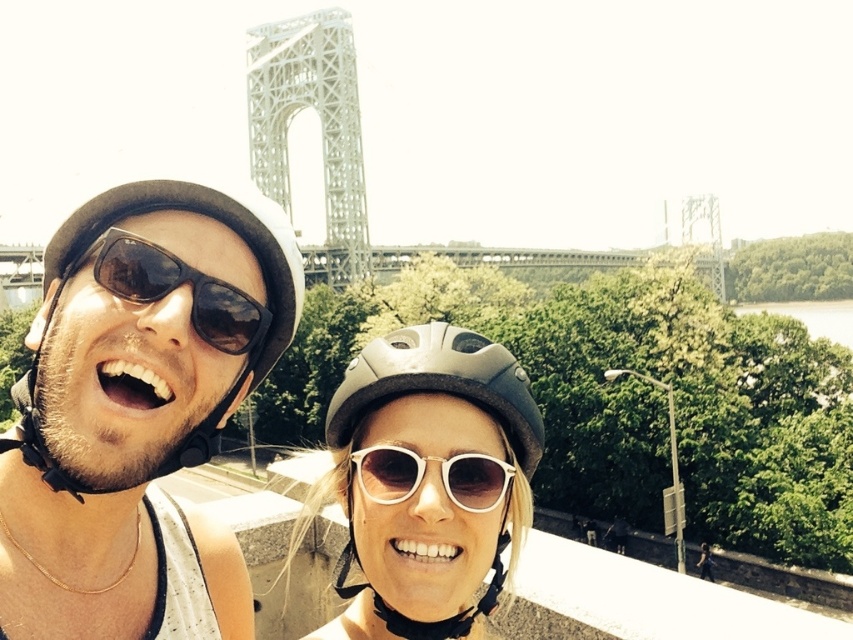
At what (x,y) coordinates should I click in order to perform the action: click on matte black helmet at left. Please return your answer as a coordinate pair (x, y). This screenshot has width=853, height=640. Looking at the image, I should click on (132, 392).

Between point (41, 420) and point (509, 355), which one is positioned in front?

Point (41, 420) is in front.

Where is `matte black helmet at left`? The width and height of the screenshot is (853, 640). matte black helmet at left is located at coordinates (132, 392).

Is white metal structure at upper center to the right of black matte sunglasses at center from the viewer's perspective?

No, white metal structure at upper center is not to the right of black matte sunglasses at center.

Consider the image. Can you confirm if white metal structure at upper center is positioned to the left of black matte sunglasses at center?

Yes, white metal structure at upper center is to the left of black matte sunglasses at center.

Which is behind, point (296, 42) or point (202, 337)?

Point (296, 42)

Where is `white metal structure at upper center`? This screenshot has width=853, height=640. white metal structure at upper center is located at coordinates (318, 122).

You are a GUI agent. You are given a task and a screenshot of the screen. Output one action in this format:
    pyautogui.click(x=<x>, y=<y>)
    Task: Click on the matte black helmet at left
    This screenshot has width=853, height=640.
    Given the screenshot: What is the action you would take?
    pyautogui.click(x=132, y=392)

Can you confirm if matte black helmet at left is positioned below black matte sunglasses at center?

Correct, matte black helmet at left is located below black matte sunglasses at center.

Which is behind, point (158, 310) or point (260, 342)?

The point (260, 342) is behind.

Find the location of `matte black helmet at left`. matte black helmet at left is located at coordinates (132, 392).